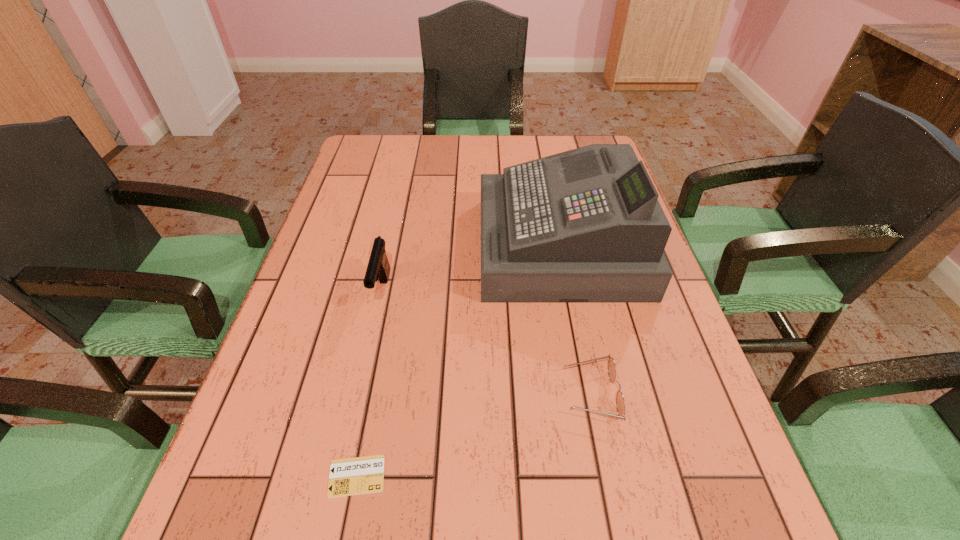
You are a GUI agent. You are given a task and a screenshot of the screen. Output one action in this format:
    pyautogui.click(x=<x>, y=<y>)
    Task: Click on the tallest object
    
    Given the screenshot: What is the action you would take?
    pyautogui.click(x=583, y=226)

Find the location of a particular element. This screenshot has height=540, width=960. the second tallest object is located at coordinates (378, 266).

I want to click on the third tallest object, so click(x=620, y=402).

This screenshot has width=960, height=540. What are the coordinates of `the second nearest object` in the screenshot? It's located at (620, 402).

This screenshot has width=960, height=540. I want to click on the nearest object, so click(x=362, y=475).

You are a GUI agent. You are given a task and a screenshot of the screen. Output one action in this format:
    pyautogui.click(x=<x>, y=<y>)
    Task: Click on the shortest object
    
    Given the screenshot: What is the action you would take?
    pyautogui.click(x=362, y=475)

The image size is (960, 540). Identify the location of free space located 0.400m on the front-facing side of the cash register. (324, 246).

This screenshot has width=960, height=540. I want to click on vacant space situated on the front-facing side of the cash register, so click(x=449, y=246).

This screenshot has height=540, width=960. I want to click on free spot located 0.210m on the front-facing side of the cash register, so click(398, 246).

Find the location of `vacant space located 0.090m at the barrel of the pistol`. vacant space located 0.090m at the barrel of the pistol is located at coordinates (369, 351).